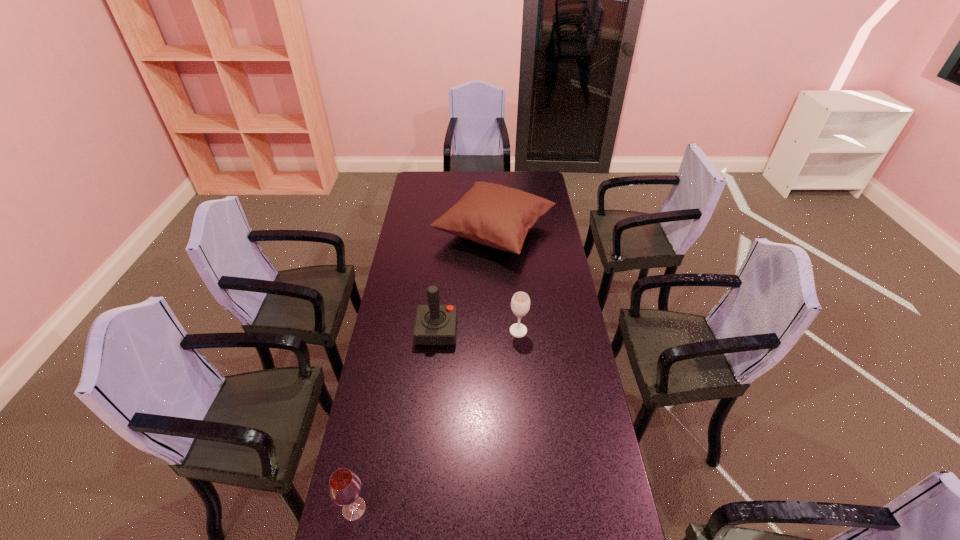
Where is `vacant area that lies between the right wineglass and the left wineglass`? The image size is (960, 540). vacant area that lies between the right wineglass and the left wineglass is located at coordinates (436, 420).

Select which object appears as the closest to the joystick. Please provide its 2D coordinates. Your answer should be formatted as a tuple, i.e. [(x, y)], where the tuple contains the x and y coordinates of a point satisfying the conditions above.

[(520, 303)]

At what (x,y) coordinates should I click in order to perform the action: click on object that is the closest to the cushion. Please return your answer as a coordinate pair (x, y). Looking at the image, I should click on (435, 324).

This screenshot has width=960, height=540. What are the coordinates of `free space that satisfies the following two spatial constraints: 1. on the front side of the farthest object; 2. on the right side of the farther wineglass` in the screenshot? It's located at (498, 331).

At what (x,y) coordinates should I click in order to perform the action: click on vacant space that satisfies the following two spatial constraints: 1. on the front side of the cushion; 2. on the base of the joystick. Please return your answer as a coordinate pair (x, y). This screenshot has width=960, height=540. Looking at the image, I should click on (498, 331).